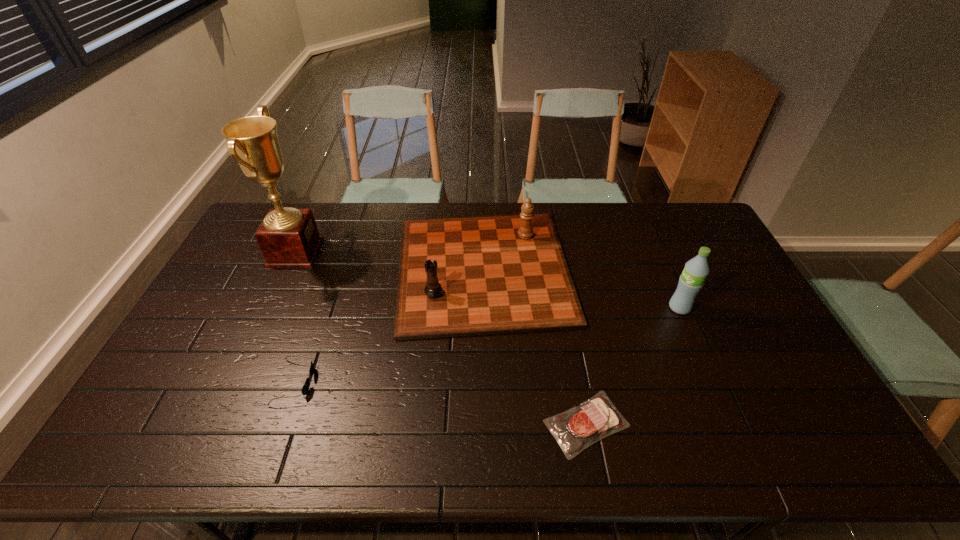
Locate an element on the screen. This screenshot has width=960, height=540. vacant area that lies between the trophy cup and the sunglasses is located at coordinates click(x=295, y=317).

Where is `vacant area that lies between the fourth object from right to left and the third tallest object`? vacant area that lies between the fourth object from right to left and the third tallest object is located at coordinates (389, 326).

Locate an element on the screen. This screenshot has height=540, width=960. object that is the second closest to the gameboard is located at coordinates (305, 388).

Identify which object is located as the fourth nearest to the third tallest object. Please provide its 2D coordinates. Your answer should be formatted as a tuple, i.e. [(x, y)], where the tuple contains the x and y coordinates of a point satisfying the conditions above.

[(288, 237)]

The image size is (960, 540). Identify the location of vacant point that satisfies the following two spatial constraints: 1. on the plaque of the tallest object; 2. on the right side of the rightmost object. (270, 308).

The image size is (960, 540). Identify the location of vacant area in the image that satisfies the following two spatial constraints: 1. on the front side of the third tallest object; 2. on the left side of the rightmost object. (484, 308).

This screenshot has height=540, width=960. In order to click on free space that satisfies the following two spatial constraints: 1. on the plaque of the water bottle; 2. on the left side of the trophy cup in this screenshot , I will do `click(270, 308)`.

This screenshot has height=540, width=960. Identify the location of free space that satisfies the following two spatial constraints: 1. on the back side of the shortest object; 2. on the plaque of the tallest object. (555, 252).

What are the coordinates of `free space that satisfies the following two spatial constraints: 1. on the front side of the third shortest object; 2. on the right side of the rightmost object` in the screenshot? It's located at (484, 308).

Identify the location of free spot that satisfies the following two spatial constraints: 1. on the plaque of the gameboard; 2. on the left side of the trophy cup. (288, 269).